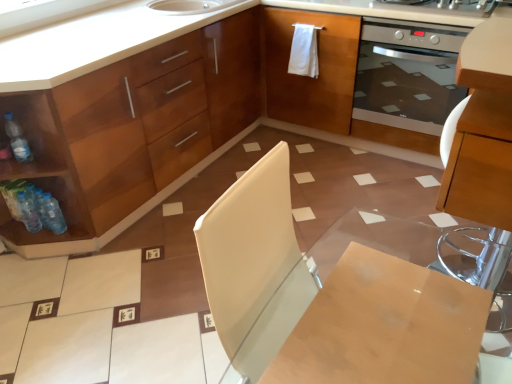
Question: Should I look upward or downward to see matte wood cabinet at center?

Choices:
 (A) up
 (B) down

Answer: (A)

Question: From the image's perspective, is stainless steel oven at upper right below translucent plastic bottle at lower left, the first bottle from the bottom?

Choices:
 (A) yes
 (B) no

Answer: (B)

Question: Is stainless steel oven at upper right next to translucent plastic bottle at lower left, which is the 3th bottle from top to bottom, and touching it?

Choices:
 (A) yes
 (B) no

Answer: (B)

Question: Does stainless steel oven at upper right appear on the left side of translucent plastic bottle at lower left, the first bottle from the bottom?

Choices:
 (A) yes
 (B) no

Answer: (B)

Question: Is the depth of stainless steel oven at upper right greater than that of translucent plastic bottle at lower left, which is the 3th bottle from top to bottom?

Choices:
 (A) yes
 (B) no

Answer: (A)

Question: Can you confirm if stainless steel oven at upper right is smaller than translucent plastic bottle at lower left, the first bottle from the bottom?

Choices:
 (A) yes
 (B) no

Answer: (B)

Question: Does stainless steel oven at upper right turn towards translucent plastic bottle at lower left, which is the 3th bottle from top to bottom?

Choices:
 (A) yes
 (B) no

Answer: (B)

Question: Can you confirm if satin silver oven at right is wider than matte wood cabinet at center?

Choices:
 (A) no
 (B) yes

Answer: (A)

Question: From the image's perspective, is satin silver oven at right located above matte wood cabinet at center?

Choices:
 (A) yes
 (B) no

Answer: (A)

Question: Is satin silver oven at right in front of matte wood cabinet at center?

Choices:
 (A) no
 (B) yes

Answer: (A)

Question: Can you confirm if satin silver oven at right is taller than matte wood cabinet at center?

Choices:
 (A) no
 (B) yes

Answer: (A)

Question: Considering the relative sizes of satin silver oven at right and matte wood cabinet at center in the image provided, is satin silver oven at right smaller than matte wood cabinet at center?

Choices:
 (A) yes
 (B) no

Answer: (A)

Question: Is satin silver oven at right to the right of matte wood cabinet at center from the viewer's perspective?

Choices:
 (A) no
 (B) yes

Answer: (B)

Question: Does translucent plastic bottles at lower left, the 2th bottle when ordered from bottom to top, appear on the right side of wooden table at center?

Choices:
 (A) yes
 (B) no

Answer: (B)